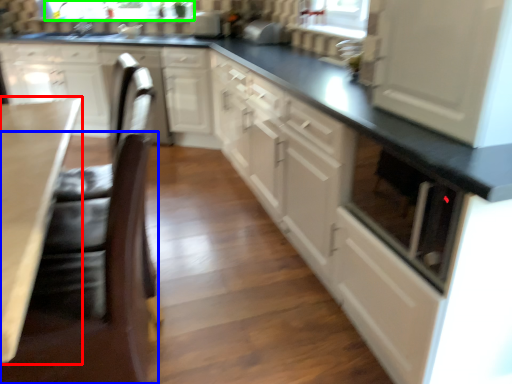
Question: Based on their relative distances, which object is nearer to countertop (highlighted by a red box)? Choose from swivel chair (highlighted by a blue box) and bay window (highlighted by a green box).

Choices:
 (A) swivel chair
 (B) bay window

Answer: (A)